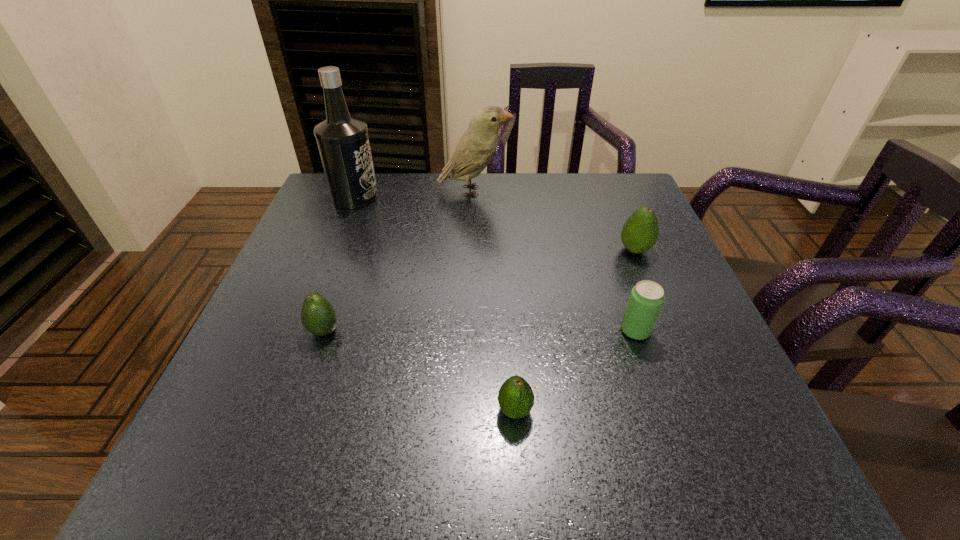
Locate an element on the screen. liquor is located at coordinates (343, 142).

Where is `the second tallest object`? The width and height of the screenshot is (960, 540). the second tallest object is located at coordinates (477, 146).

The width and height of the screenshot is (960, 540). I want to click on the farthest avocado, so click(x=640, y=232).

Image resolution: width=960 pixels, height=540 pixels. In order to click on the fourth nearest object in this screenshot , I will do `click(640, 232)`.

Find the location of a particular element. This screenshot has width=960, height=540. soda is located at coordinates (646, 299).

The width and height of the screenshot is (960, 540). Identify the location of the second farthest avocado. (318, 316).

This screenshot has width=960, height=540. Find the location of `the second avocado from left to right`. the second avocado from left to right is located at coordinates (515, 397).

Where is `the nearest avocado`? Image resolution: width=960 pixels, height=540 pixels. the nearest avocado is located at coordinates (515, 397).

Identify the location of vacant space situated on the front label of the liquor. (445, 197).

This screenshot has width=960, height=540. What are the coordinates of `free space located at the face of the bird` in the screenshot? It's located at (637, 191).